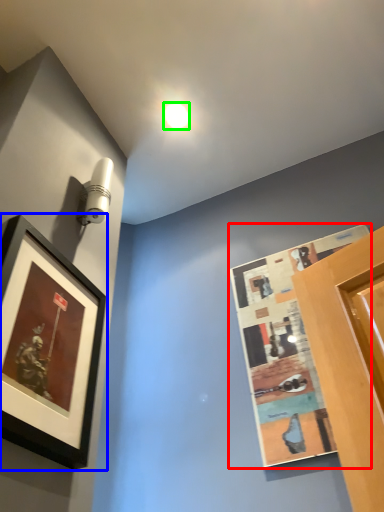
Question: Which object is the farthest from picture frame (highlighted by a red box)? Choose among these: picture frame (highlighted by a blue box) or droplight (highlighted by a green box).

Choices:
 (A) picture frame
 (B) droplight

Answer: (B)